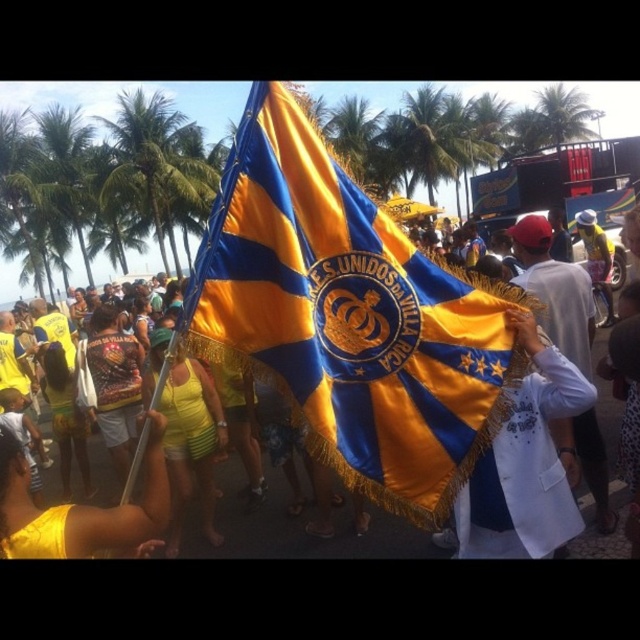
Question: Can you confirm if green leafy palm tree at upper left is bigger than white cotton shirt at center?

Choices:
 (A) yes
 (B) no

Answer: (A)

Question: Observing the image, what is the correct spatial positioning of satin yellow-blue flag at center in reference to green leafy palm tree at upper left?

Choices:
 (A) above
 (B) below

Answer: (B)

Question: Which is nearer to the green leafy palm tree at upper left?

Choices:
 (A) satin yellow-blue flag at center
 (B) white cotton shirt at center

Answer: (B)

Question: Which of the following is the farthest from the observer?

Choices:
 (A) white cotton shirt at center
 (B) green leafy palm tree at upper left

Answer: (B)

Question: Can you confirm if satin yellow-blue flag at center is smaller than green leafy palm tree at upper left?

Choices:
 (A) yes
 (B) no

Answer: (A)

Question: Which of the following is the closest to the observer?

Choices:
 (A) pos(330,273)
 (B) pos(180,211)

Answer: (A)